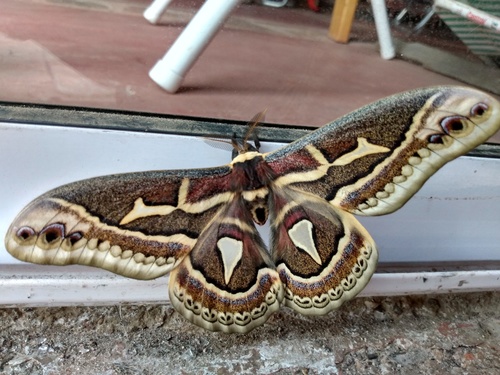
Image resolution: width=500 pixels, height=375 pixels. I want to click on empty space on floor, so click(102, 58).